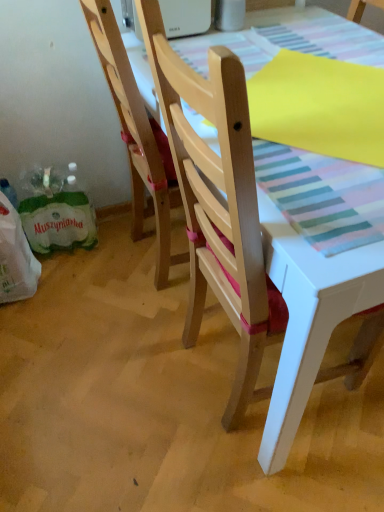
Where is `free space between green paper shopping bag at lower left and green plastic grocery bag at lower left`? The width and height of the screenshot is (384, 512). free space between green paper shopping bag at lower left and green plastic grocery bag at lower left is located at coordinates (62, 271).